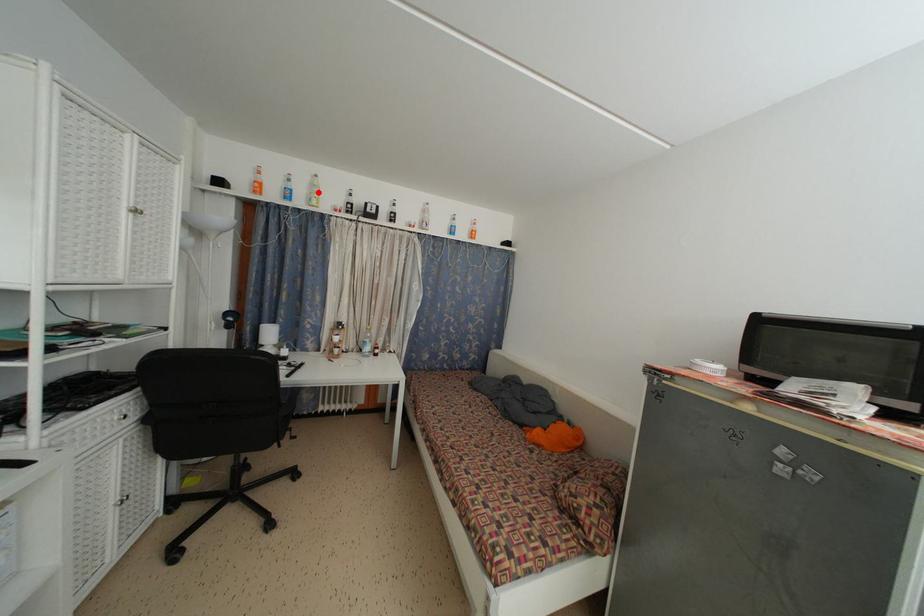
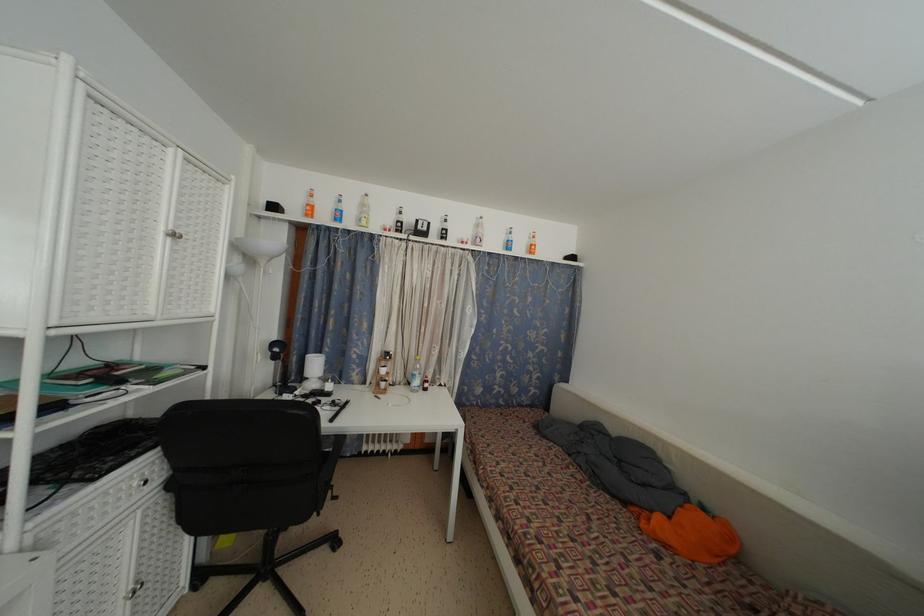
Find the pixel in the second image that matches the highlighted location in the first image.

(368, 213)